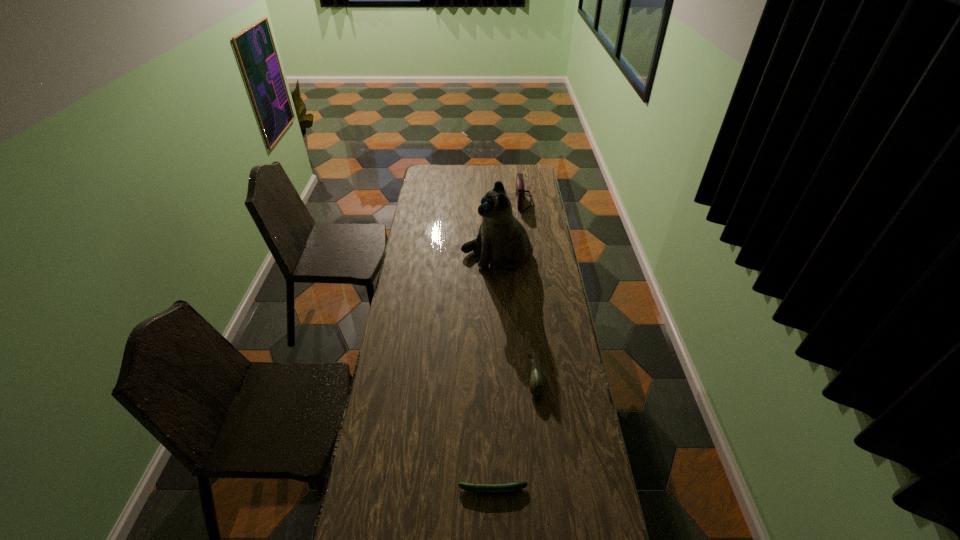
Find the location of a particular element. cat at the right edge is located at coordinates (502, 239).

Image resolution: width=960 pixels, height=540 pixels. I want to click on shoulder bag that is positioned at the right edge, so click(x=520, y=191).

In order to click on zucchini located in the right edge section of the desktop in this screenshot , I will do `click(537, 385)`.

This screenshot has width=960, height=540. In the image, there is a desktop. Find the location of `vacant space at the far edge`. vacant space at the far edge is located at coordinates [490, 168].

This screenshot has width=960, height=540. What are the coordinates of `vacant space at the left edge of the desktop` in the screenshot? It's located at (419, 260).

In the image, there is a desktop. What are the coordinates of `free space at the right edge` in the screenshot? It's located at (561, 453).

In the image, there is a desktop. Where is `vacant space at the far left corner`? The image size is (960, 540). vacant space at the far left corner is located at coordinates (423, 168).

You are a GUI agent. You are given a task and a screenshot of the screen. Output one action in this format:
    pyautogui.click(x=<x>, y=<y>)
    Task: Click on the empty space that is in between the cat and the second nearest object
    The width and height of the screenshot is (960, 540).
    Given the screenshot: What is the action you would take?
    pyautogui.click(x=516, y=317)

At what (x,y) coordinates should I click in order to perform the action: click on empty space that is in between the cat and the nearer zucchini. Please return your answer as a coordinate pair (x, y). This screenshot has width=960, height=540. Looking at the image, I should click on (494, 373).

Image resolution: width=960 pixels, height=540 pixels. I want to click on unoccupied area between the left zucchini and the shoulder bag, so [x=508, y=346].